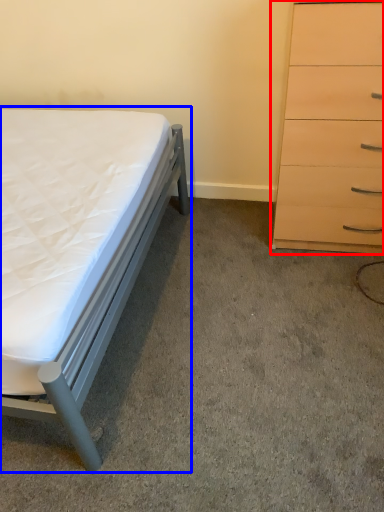
Question: Which point is further to the camera, chest of drawers (highlighted by a red box) or bed (highlighted by a blue box)?

Choices:
 (A) chest of drawers
 (B) bed

Answer: (A)